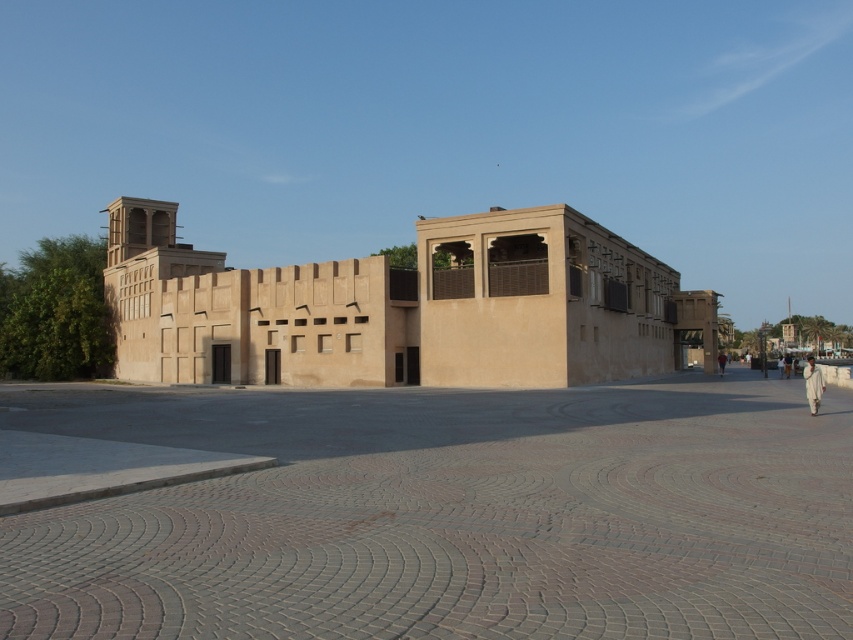
You are an architect designing a new outdoor space adjacent to the traditional building. The plaza and clothing are part of the existing layout. If you want to place a 2.5 meter wide sculpture between the smooth sandstone plaza at center and the white cotton clothing at right, will there be enough space?

The smooth sandstone plaza at center is narrower than the white cotton clothing at right. However, the exact dimensions required for the sculpture placement aren

You are standing at the entrance of the beige sandstone building at center. Which direction should you face to see the point at coordinates [393,307]?

The beige sandstone building at center is located at point [393,307], so you should face the direction of the beige sandstone building at center to see the point at coordinates [393,307].